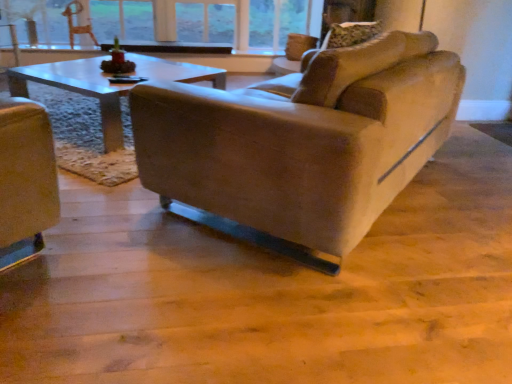
Question: Visually, is suede-like beige couch at center positioned to the left or to the right of wooden textured swivel chair at upper left?

Choices:
 (A) right
 (B) left

Answer: (A)

Question: Choose the correct answer: Is suede-like beige couch at center inside wooden textured swivel chair at upper left or outside it?

Choices:
 (A) inside
 (B) outside

Answer: (B)

Question: Which is farther from the wooden textured swivel chair at upper left?

Choices:
 (A) clear glass window at upper center
 (B) suede-like beige couch at center

Answer: (B)

Question: Which of these objects is positioned closest to the wooden textured swivel chair at upper left?

Choices:
 (A) suede-like beige couch at center
 (B) clear glass window at upper center

Answer: (B)